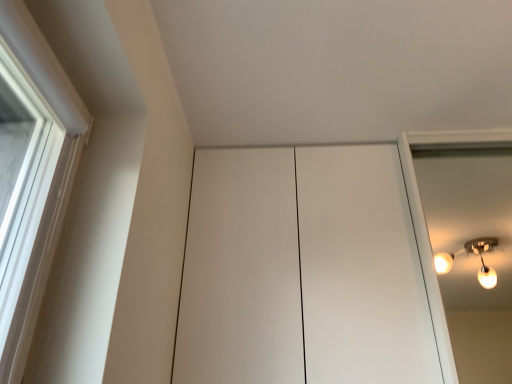
Measure the distance between white matte cabinet at center and camera.

They are 1.22 meters apart.

The height and width of the screenshot is (384, 512). What do you see at coordinates (302, 270) in the screenshot?
I see `white matte cabinet at center` at bounding box center [302, 270].

What is the approximate width of white matte cabinet at center?

The width of white matte cabinet at center is 20.87 inches.

The height and width of the screenshot is (384, 512). What are the coordinates of `white matte cabinet at center` in the screenshot? It's located at (302, 270).

I want to click on white matte cabinet at center, so click(302, 270).